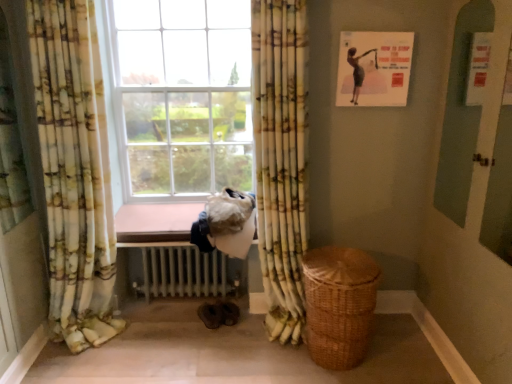
Question: From the image's perspective, is yellow-green floral fabric curtain at center, positioned as the first curtain in right-to-left order, positioned above or below white metallic radiator at lower center?

Choices:
 (A) below
 (B) above

Answer: (B)

Question: Based on their sizes in the image, would you say yellow-green floral fabric curtain at center, which is the 2th curtain in left-to-right order, is bigger or smaller than white metallic radiator at lower center?

Choices:
 (A) big
 (B) small

Answer: (A)

Question: Which is nearer to the brown wooden window sill at center?

Choices:
 (A) yellow-green floral fabric curtain at center, positioned as the first curtain in right-to-left order
 (B) floral fabric curtain at left, which appears as the 1th curtain when viewed from the left
 (C) white metallic radiator at lower center
 (D) woven brown basket at lower right

Answer: (C)

Question: Which object is positioned closest to the yellow-green floral fabric curtain at center, which is the 2th curtain in left-to-right order?

Choices:
 (A) woven brown basket at lower right
 (B) floral fabric curtain at left, which appears as the 1th curtain when viewed from the left
 (C) white metallic radiator at lower center
 (D) brown wooden window sill at center

Answer: (A)